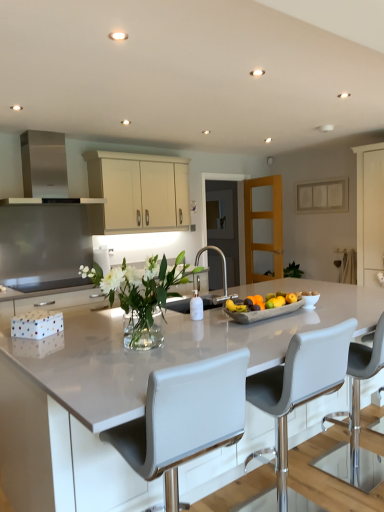
Question: Which direction should I rotate to face white leather chair at center, arranged as the 2th chair when viewed from the right, — up or down?

Choices:
 (A) down
 (B) up

Answer: (A)

Question: From a real-world perspective, is clear glass door at center, which is counted as the second glass door, starting from the right, beneath white leather chair at center, positioned as the second chair in left-to-right order?

Choices:
 (A) yes
 (B) no

Answer: (B)

Question: Is clear glass door at center, the 1th glass door when ordered from left to right, positioned with its back to white leather chair at center, positioned as the second chair in left-to-right order?

Choices:
 (A) yes
 (B) no

Answer: (B)

Question: Is clear glass door at center, which is counted as the second glass door, starting from the right, closer to camera compared to white leather chair at center, positioned as the second chair in left-to-right order?

Choices:
 (A) yes
 (B) no

Answer: (B)

Question: Is clear glass door at center, which is counted as the second glass door, starting from the right, at the right side of white leather chair at center, which ranks as the first chair in right-to-left order?

Choices:
 (A) yes
 (B) no

Answer: (A)

Question: Is clear glass door at center, which is counted as the second glass door, starting from the right, beside white leather chair at center, which ranks as the first chair in right-to-left order?

Choices:
 (A) yes
 (B) no

Answer: (B)

Question: From the image's perspective, does clear glass door at center, which is counted as the second glass door, starting from the right, appear higher than white leather chair at center, which ranks as the first chair in right-to-left order?

Choices:
 (A) no
 (B) yes

Answer: (B)

Question: Does clear glass vase at center have a smaller size compared to clear glass door at center, the 1th glass door when ordered from left to right?

Choices:
 (A) no
 (B) yes

Answer: (B)

Question: Considering the relative sizes of clear glass vase at center and clear glass door at center, which is counted as the second glass door, starting from the right, in the image provided, is clear glass vase at center taller than clear glass door at center, which is counted as the second glass door, starting from the right,?

Choices:
 (A) yes
 (B) no

Answer: (B)

Question: From a real-world perspective, is clear glass vase at center beneath clear glass door at center, the 1th glass door when ordered from left to right?

Choices:
 (A) yes
 (B) no

Answer: (A)

Question: Is the position of clear glass vase at center more distant than that of clear glass door at center, which is counted as the second glass door, starting from the right?

Choices:
 (A) no
 (B) yes

Answer: (A)

Question: Is clear glass vase at center next to clear glass door at center, the 1th glass door when ordered from left to right?

Choices:
 (A) no
 (B) yes

Answer: (A)

Question: From the image's perspective, would you say clear glass vase at center is shown under clear glass door at center, which is counted as the second glass door, starting from the right?

Choices:
 (A) yes
 (B) no

Answer: (A)

Question: Would you consider cream matte cabinet at upper center to be distant from clear glass vase at center?

Choices:
 (A) no
 (B) yes

Answer: (B)